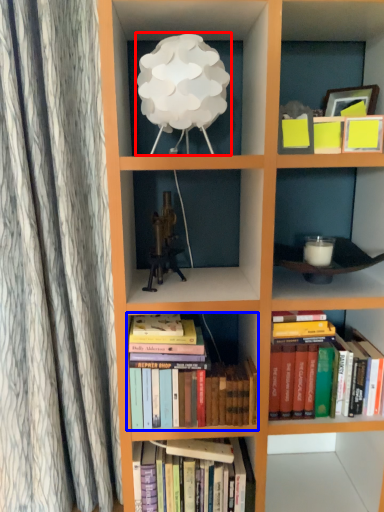
Question: Which of the following is the farthest to the observer, table lamp (highlighted by a red box) or book (highlighted by a blue box)?

Choices:
 (A) table lamp
 (B) book

Answer: (B)